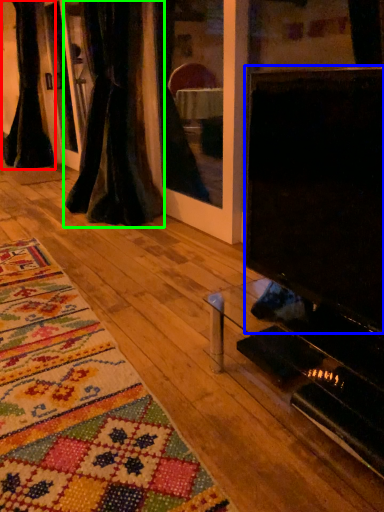
Question: Which object is positioned farthest from curtain (highlighted by a red box)? Select from screen (highlighted by a blue box) and curtain (highlighted by a green box).

Choices:
 (A) screen
 (B) curtain

Answer: (A)